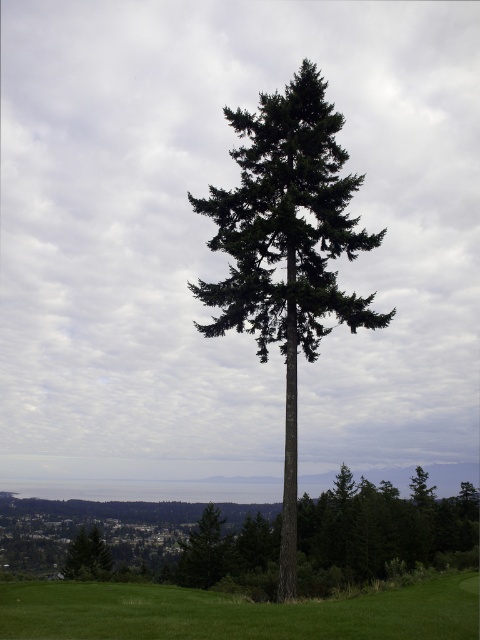
Question: Which object appears closest to the camera in this image?

Choices:
 (A) green matte tree at center
 (B) green grassy field at center

Answer: (B)

Question: Which of the following is the closest to the observer?

Choices:
 (A) green matte tree at center
 (B) green matte tree at lower left

Answer: (A)

Question: Can you confirm if green matte tree at center is positioned to the left of green grassy field at center?

Choices:
 (A) yes
 (B) no

Answer: (A)

Question: Which point is farther from the camera taking this photo?

Choices:
 (A) (34, 600)
 (B) (84, 538)

Answer: (B)

Question: Does green matte tree at center have a greater width compared to green matte tree at lower left?

Choices:
 (A) no
 (B) yes

Answer: (A)

Question: Is green matte tree at center smaller than green matte tree at lower left?

Choices:
 (A) no
 (B) yes

Answer: (B)